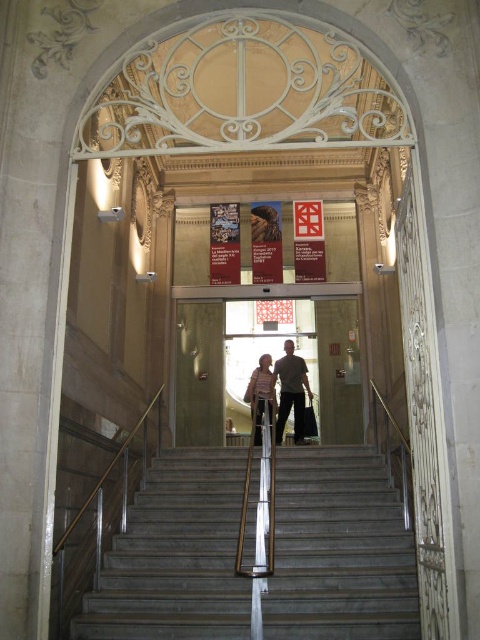
You are standing at the entrance of the grand building and see the smooth gray stairs at center and the light brown leather shoes at center. From your perspective, which object is positioned to the left?

The smooth gray stairs at center is to the left of light brown leather shoes at center, so the smooth gray stairs at center is positioned to the left.

You are standing at the entrance of the grand building and notice a point marked at coordinates [279,392]. According to the image description, what object is located at that specific coordinate?

The point at coordinates [279,392] marks light brown leather shoes at center.